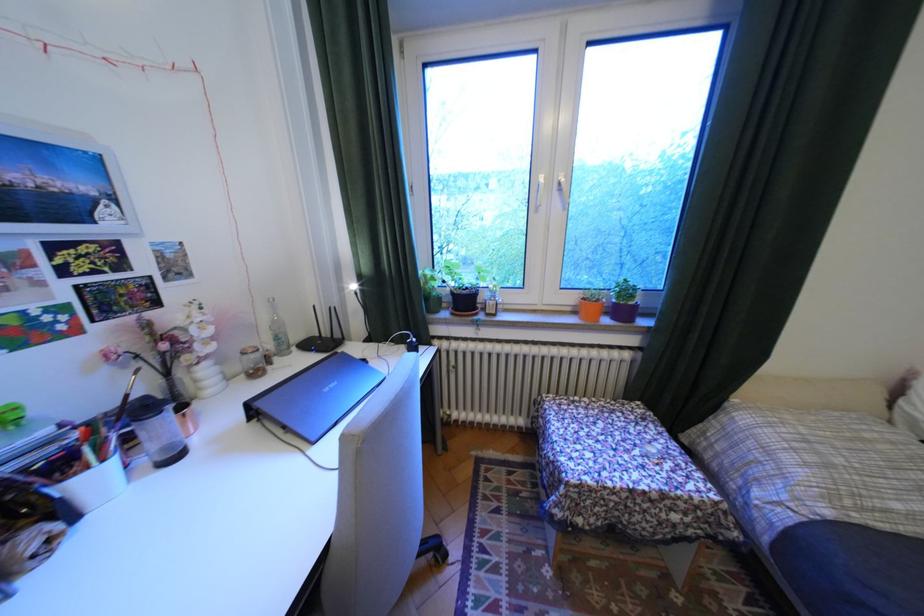
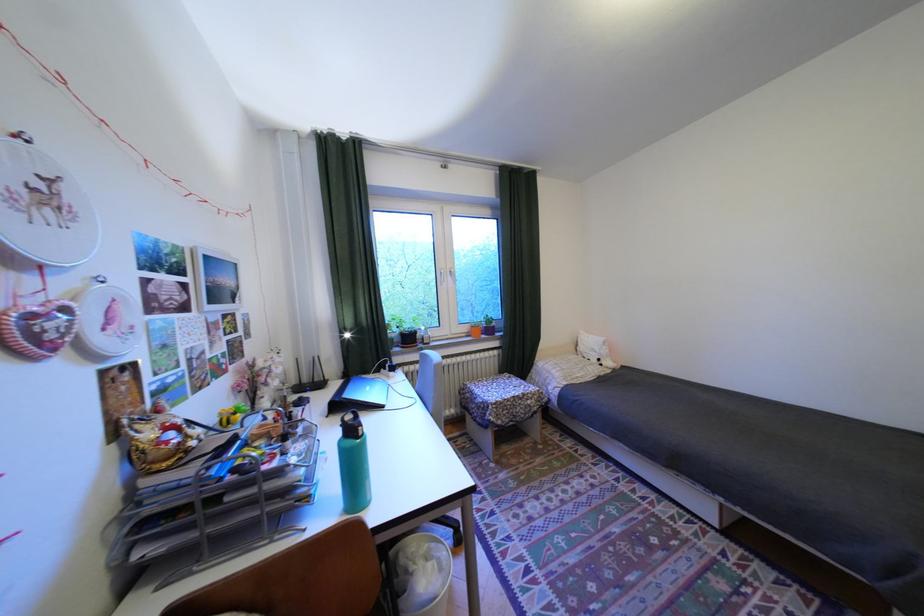
In the second image, find the point that corresponds to pixel 436 270 in the first image.

(397, 322)